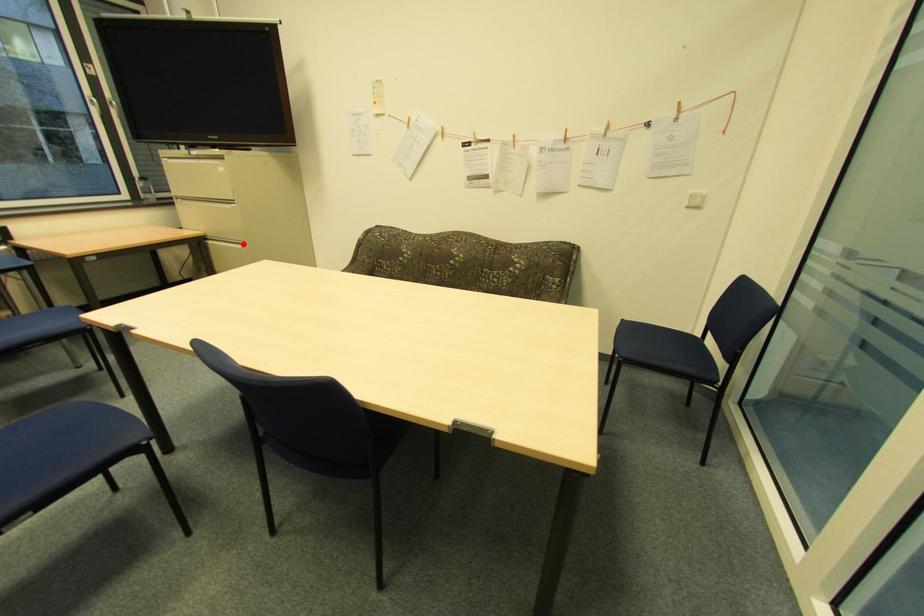
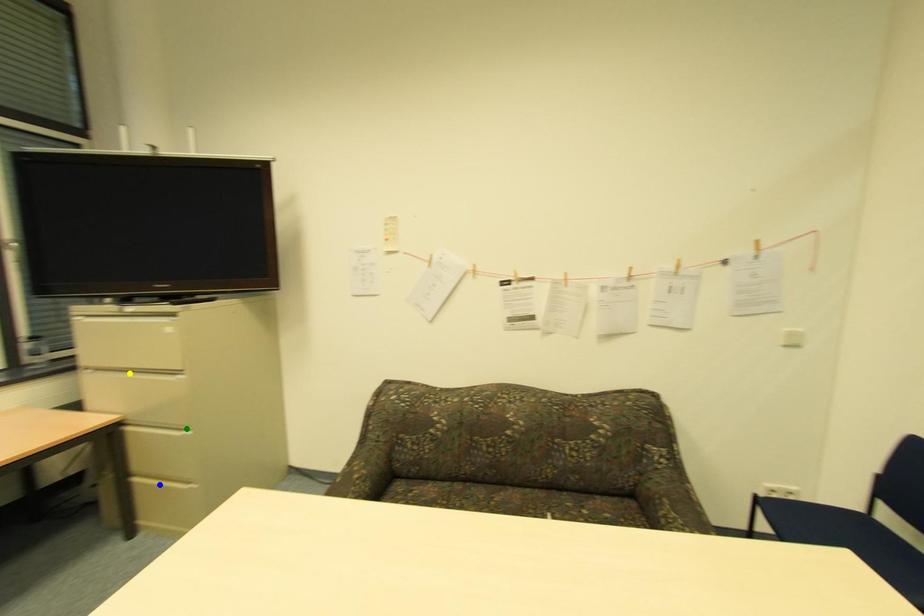
Question: I am providing you with two images of the same scene from different viewpoints. A red point is marked on the first image. You are given multiple points on the second image. Which point in image 2 is actually the same real-world point as the red point in image 1?

Choices:
 (A) green point
 (B) yellow point
 (C) blue point

Answer: (A)